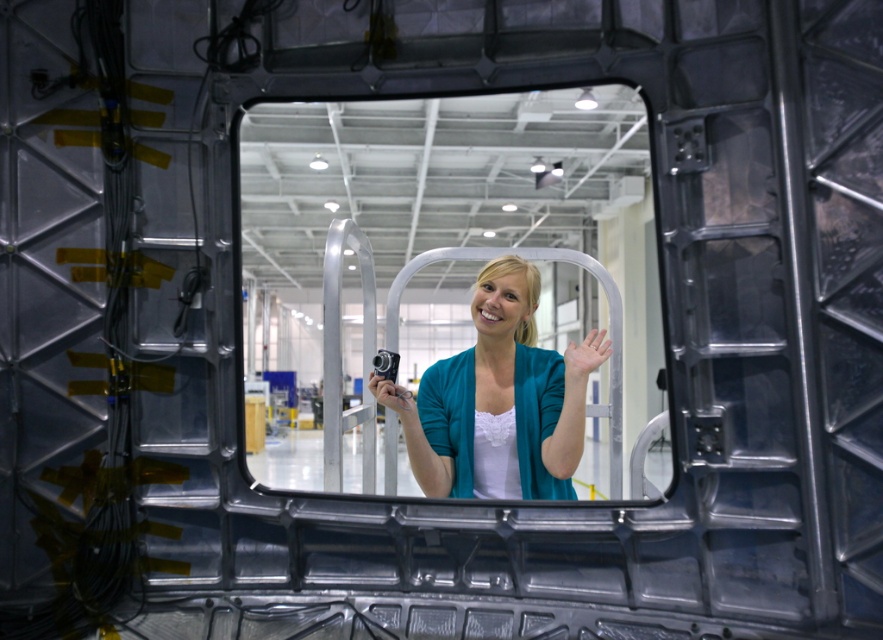
Which is more to the left, teal fabric jacket at center or matte skin hand at center?

teal fabric jacket at center

Which is below, teal fabric jacket at center or matte skin hand at center?

Positioned lower is matte skin hand at center.

Is point (557, 460) positioned in front of point (592, 356)?

No, it is behind (592, 356).

This screenshot has height=640, width=883. In order to click on teal fabric jacket at center in this screenshot , I will do (x=497, y=337).

Which is behind, point (313, 100) or point (370, 392)?

Positioned behind is point (370, 392).

Can you confirm if clear glass mirror at center is taller than matte black camera at center?

Yes, clear glass mirror at center is taller than matte black camera at center.

Between point (359, 433) and point (386, 403), which one is positioned in front?

Positioned in front is point (386, 403).

At what (x,y) coordinates should I click in order to perform the action: click on clear glass mirror at center. Please return your answer as a coordinate pair (x, y). Image resolution: width=883 pixels, height=640 pixels. Looking at the image, I should click on (431, 212).

Does teal fabric jacket at center have a larger size compared to matte black camera at center?

Indeed, teal fabric jacket at center has a larger size compared to matte black camera at center.

Does teal fabric jacket at center have a lesser height compared to matte black camera at center?

Incorrect, teal fabric jacket at center's height does not fall short of matte black camera at center's.

Which is behind, point (416, 451) or point (404, 406)?

The point (416, 451) is behind.

You are a GUI agent. You are given a task and a screenshot of the screen. Output one action in this format:
    pyautogui.click(x=<x>, y=<y>)
    Task: Click on the teal fabric jacket at center
    This screenshot has width=883, height=640.
    Given the screenshot: What is the action you would take?
    pyautogui.click(x=497, y=337)